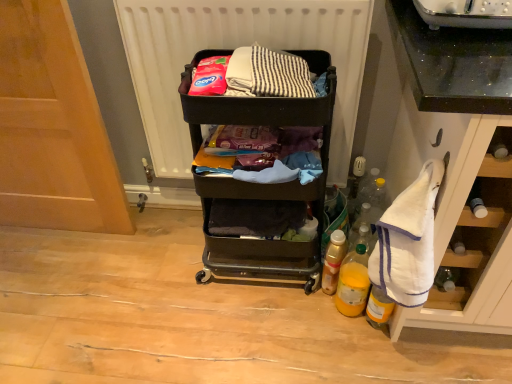
Locate an element on the screen. Image resolution: width=512 pixels, height=384 pixels. free point in front of wooden at left is located at coordinates (66, 303).